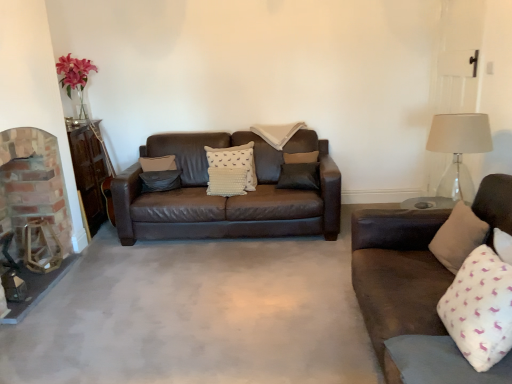
Question: Is white textured pillow at center, the fourth pillow positioned from the right, with beige fabric pillow at center, the first pillow from the back?

Choices:
 (A) yes
 (B) no

Answer: (B)

Question: Could beige fabric pillow at center, placed as the third pillow when sorted from right to left, be considered to be inside white textured pillow at center, the third pillow positioned from the back?

Choices:
 (A) yes
 (B) no

Answer: (B)

Question: Does white textured pillow at center, the third pillow positioned from the back, have a greater height compared to beige fabric pillow at center, placed as the third pillow when sorted from right to left?

Choices:
 (A) no
 (B) yes

Answer: (B)

Question: Is white textured pillow at center, the fourth pillow positioned from the right, bigger than beige fabric pillow at center, placed as the third pillow when sorted from right to left?

Choices:
 (A) no
 (B) yes

Answer: (A)

Question: Considering the relative sizes of white textured pillow at center, marked as the 3th pillow in a front-to-back arrangement, and beige fabric pillow at center, the first pillow from the back, in the image provided, is white textured pillow at center, marked as the 3th pillow in a front-to-back arrangement, shorter than beige fabric pillow at center, the first pillow from the back,?

Choices:
 (A) no
 (B) yes

Answer: (A)

Question: Considering the relative sizes of white textured pillow at center, marked as the 3th pillow in a front-to-back arrangement, and beige fabric pillow at center, placed as the third pillow when sorted from right to left, in the image provided, is white textured pillow at center, marked as the 3th pillow in a front-to-back arrangement, wider than beige fabric pillow at center, placed as the third pillow when sorted from right to left,?

Choices:
 (A) no
 (B) yes

Answer: (A)

Question: Would you say white soft pillow at right, which is counted as the fourth pillow, starting from the left, contains beige fabric pillow at center, the third pillow positioned from the left?

Choices:
 (A) yes
 (B) no

Answer: (B)

Question: Are white soft pillow at right, which is counted as the fourth pillow, starting from the left, and beige fabric pillow at center, the third pillow positioned from the left, located far from each other?

Choices:
 (A) no
 (B) yes

Answer: (B)

Question: Considering the relative sizes of white soft pillow at right, the 1th pillow in the front-to-back sequence, and beige fabric pillow at center, the first pillow from the back, in the image provided, is white soft pillow at right, the 1th pillow in the front-to-back sequence, thinner than beige fabric pillow at center, the first pillow from the back,?

Choices:
 (A) yes
 (B) no

Answer: (A)

Question: Can you confirm if white soft pillow at right, which appears as the fifth pillow when viewed from the back, is positioned to the right of beige fabric pillow at center, placed as the third pillow when sorted from right to left?

Choices:
 (A) no
 (B) yes

Answer: (B)

Question: From a real-world perspective, is white soft pillow at right, which is counted as the fourth pillow, starting from the left, on top of beige fabric pillow at center, placed as the third pillow when sorted from right to left?

Choices:
 (A) no
 (B) yes

Answer: (A)

Question: Is white soft pillow at right, which ranks as the second pillow in right-to-left order, further to the viewer compared to beige fabric pillow at center, the first pillow from the back?

Choices:
 (A) yes
 (B) no

Answer: (B)

Question: Does beige fabric pillow at center, the third pillow positioned from the left, have a lesser height compared to white textured pillow at center, which ranks as the 2th pillow in left-to-right order?

Choices:
 (A) no
 (B) yes

Answer: (B)